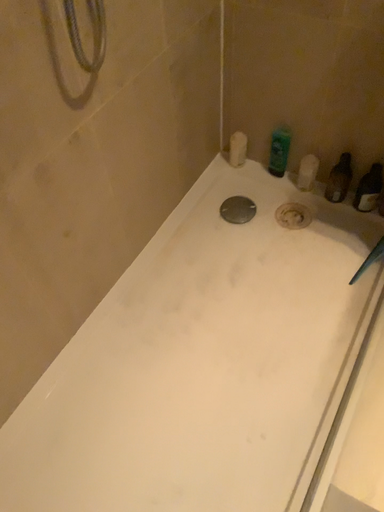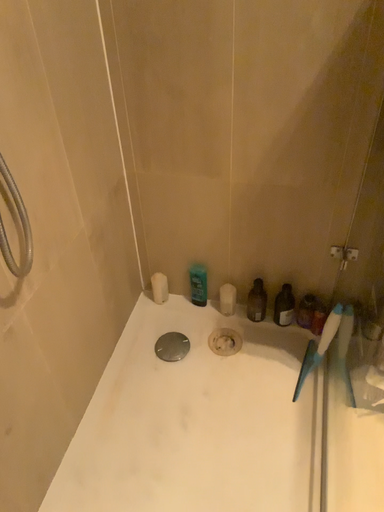
Question: Which way did the camera rotate in the video?

Choices:
 (A) rotated upward
 (B) rotated downward

Answer: (A)